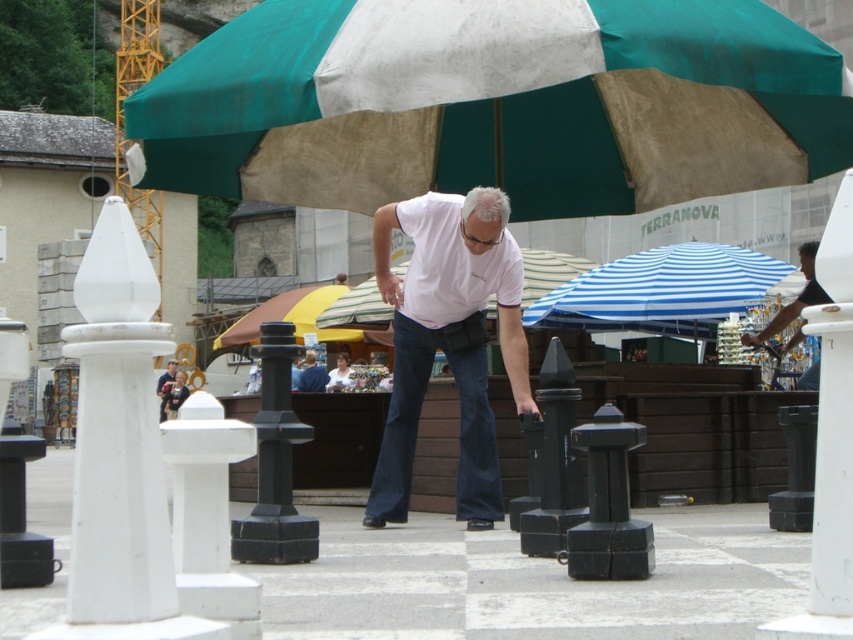
Is green fabric umbrella at upper center closer to the viewer compared to blue striped fabric umbrella at center?

Yes, it is.

In the scene shown: Can you confirm if green fabric umbrella at upper center is shorter than blue striped fabric umbrella at center?

Incorrect, green fabric umbrella at upper center's height does not fall short of blue striped fabric umbrella at center's.

Is point (428, 58) farther from camera compared to point (717, 310)?

No, (428, 58) is closer to viewer.

Locate an element on the screen. The height and width of the screenshot is (640, 853). green fabric umbrella at upper center is located at coordinates (496, 104).

Who is more forward, [370,305] or [804,252]?

Point [804,252] is in front.

Where is `white striped umbrella at center`? white striped umbrella at center is located at coordinates (548, 272).

Can you confirm if green fabric umbrella at upper center is bigger than white striped umbrella at center?

Actually, green fabric umbrella at upper center might be smaller than white striped umbrella at center.

Can you confirm if green fabric umbrella at upper center is smaller than white striped umbrella at center?

Yes.

At what (x,y) coordinates should I click in order to perform the action: click on green fabric umbrella at upper center. Please return your answer as a coordinate pair (x, y). This screenshot has width=853, height=640. Looking at the image, I should click on (496, 104).